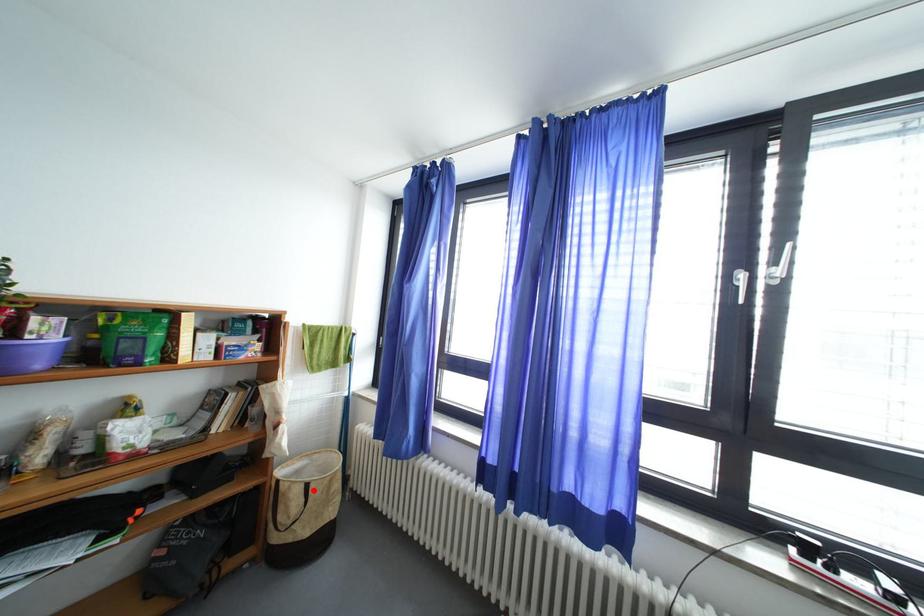
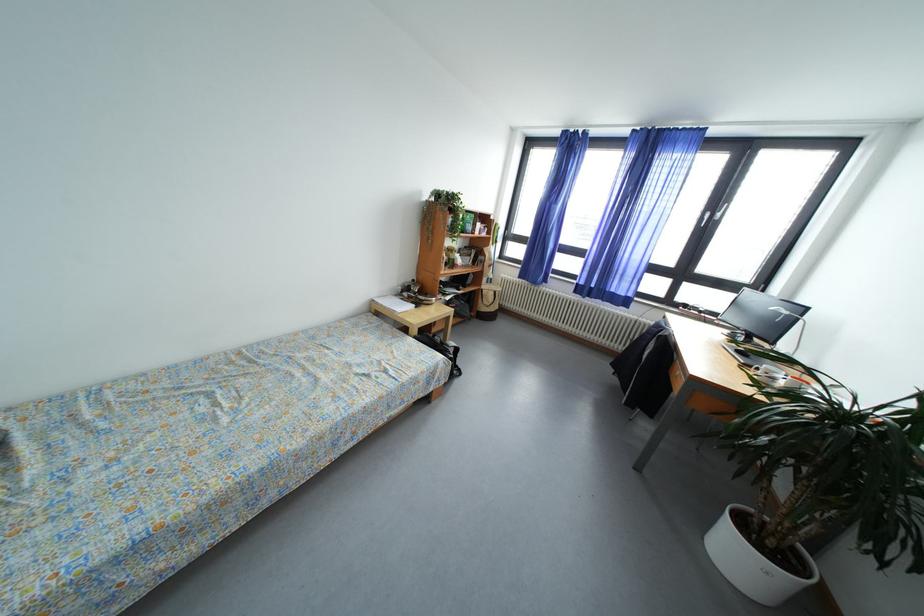
The point at the highlighted location is marked in the first image. Where is the corresponding point in the second image?

(502, 297)